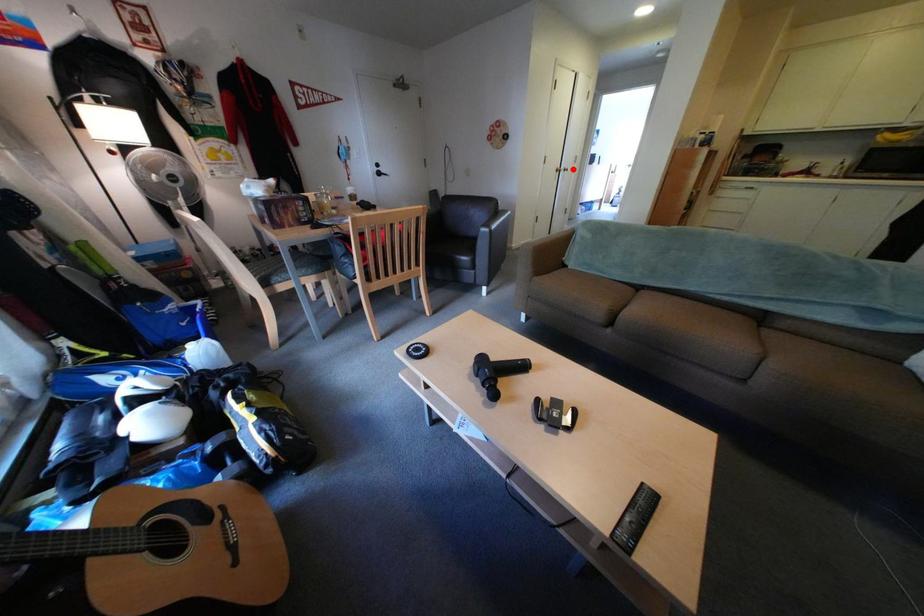
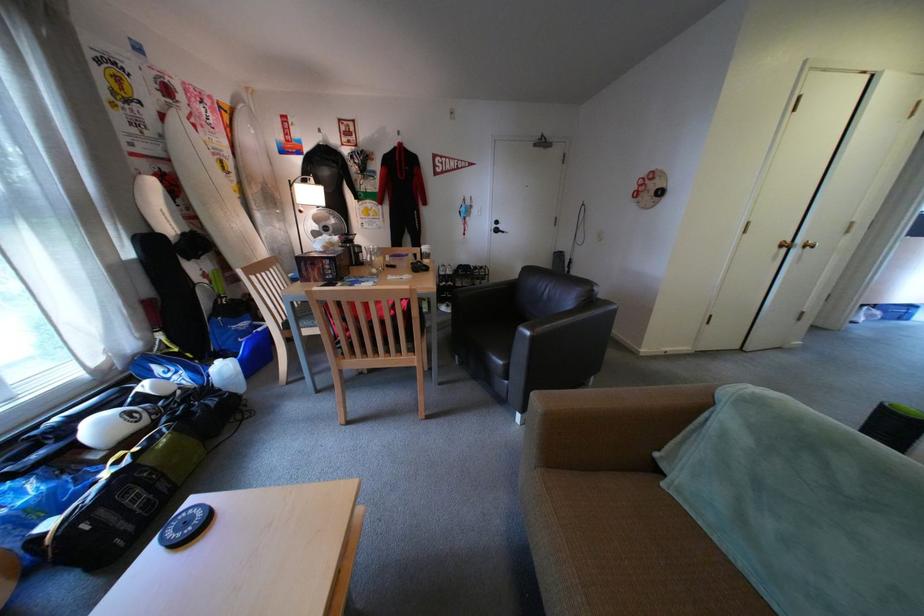
Where in the second image is the point corresponding to the highlighted location from the first image?

(804, 241)